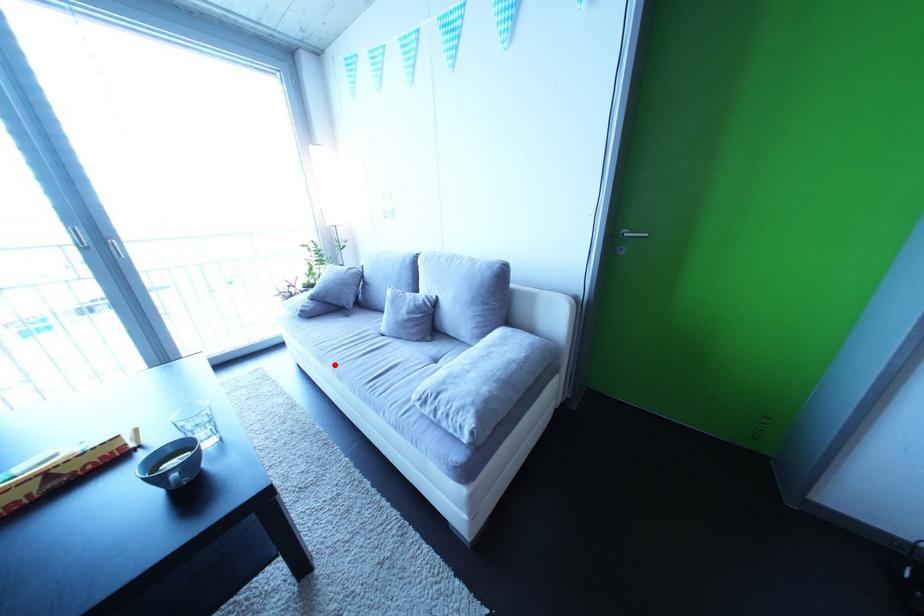
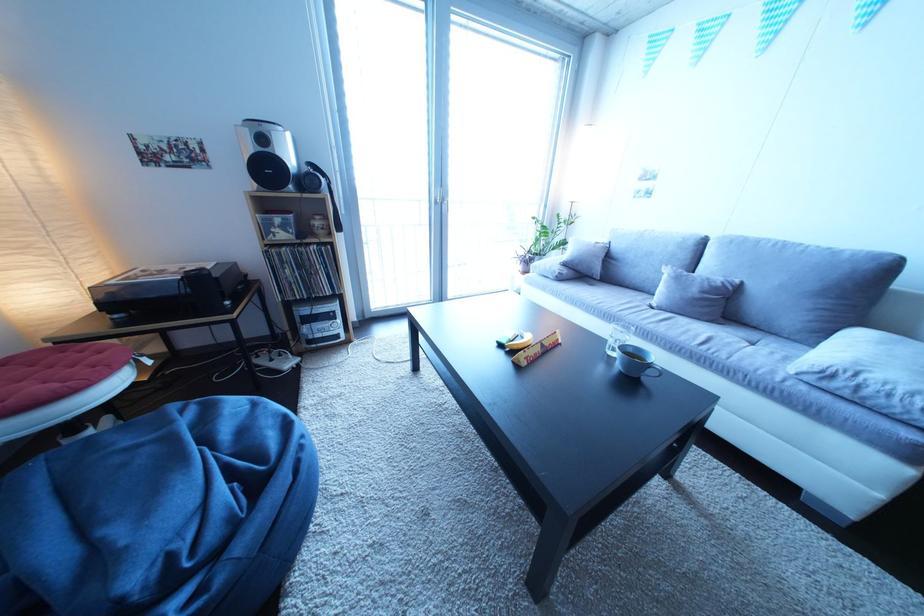
Question: I am providing you with two images of the same scene from different viewpoints. A red point is shown in image1. For the corresponding object point in image2, is it positioned nearer or farther from the camera?

Choices:
 (A) Nearer
 (B) Farther

Answer: (A)